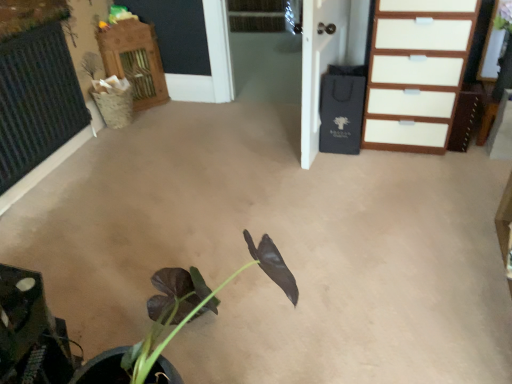
The height and width of the screenshot is (384, 512). What do you see at coordinates (134, 60) in the screenshot?
I see `wooden cabinet at upper left` at bounding box center [134, 60].

Describe the element at coordinates (416, 72) in the screenshot. I see `white glossy chest of drawers at upper right` at that location.

What do you see at coordinates (319, 64) in the screenshot? This screenshot has width=512, height=384. I see `black paper bag at upper right` at bounding box center [319, 64].

The width and height of the screenshot is (512, 384). What are the coordinates of `wooden cabinet at upper left` in the screenshot? It's located at (134, 60).

Is wooden cabinet at upper left inside black paper bag at upper right?

No, black paper bag at upper right does not contain wooden cabinet at upper left.

Based on the photo, between black paper bag at upper right and wooden cabinet at upper left, which one is positioned behind?

wooden cabinet at upper left is more distant.

Are black paper bag at upper right and wooden cabinet at upper left making contact?

No, black paper bag at upper right is not next to wooden cabinet at upper left.

Considering the sizes of objects white glossy chest of drawers at upper right and wooden cabinet at upper left in the image provided, who is bigger, white glossy chest of drawers at upper right or wooden cabinet at upper left?

white glossy chest of drawers at upper right.

You are a GUI agent. You are given a task and a screenshot of the screen. Output one action in this format:
    pyautogui.click(x=<x>, y=<y>)
    Task: Click on the chest of drawers above the wooden cabinet at upper left (from a real-world perspective)
    
    Given the screenshot: What is the action you would take?
    pyautogui.click(x=416, y=72)

Is white glossy chest of drawers at upper right positioned far away from wooden cabinet at upper left?

Absolutely, white glossy chest of drawers at upper right is distant from wooden cabinet at upper left.

Locate an element on the screen. The height and width of the screenshot is (384, 512). the chest of drawers that is above the wooden cabinet at upper left (from a real-world perspective) is located at coordinates (416, 72).

Considering the positions of points (161, 91) and (418, 128), is point (161, 91) closer to camera compared to point (418, 128)?

No, it is not.

How much distance is there between wooden cabinet at upper left and white glossy chest of drawers at upper right?

wooden cabinet at upper left is 1.91 meters away from white glossy chest of drawers at upper right.

Can you confirm if wooden cabinet at upper left is shorter than white glossy chest of drawers at upper right?

Indeed, wooden cabinet at upper left has a lesser height compared to white glossy chest of drawers at upper right.

Between wooden cabinet at upper left and black paper bag at upper right, which one has smaller width?

Thinner between the two is black paper bag at upper right.

From a real-world perspective, which object rests below the other?

In real-world perspective, wooden cabinet at upper left is lower.

Is point (135, 54) closer or farther from the camera than point (307, 102)?

Point (135, 54).

Could you tell me if wooden cabinet at upper left is turned towards black paper bag at upper right?

No, wooden cabinet at upper left is not facing towards black paper bag at upper right.

Between white glossy chest of drawers at upper right and black paper bag at upper right, which one appears on the left side from the viewer's perspective?

black paper bag at upper right.

Does white glossy chest of drawers at upper right turn towards black paper bag at upper right?

No, white glossy chest of drawers at upper right is not oriented towards black paper bag at upper right.

Is the surface of white glossy chest of drawers at upper right in direct contact with black paper bag at upper right?

No, white glossy chest of drawers at upper right is not in contact with black paper bag at upper right.

Which is behind, point (437, 16) or point (304, 148)?

Point (304, 148)

Who is taller, black paper bag at upper right or white glossy chest of drawers at upper right?

With more height is black paper bag at upper right.

Which is behind, black paper bag at upper right or white glossy chest of drawers at upper right?

white glossy chest of drawers at upper right is behind.

Is black paper bag at upper right aimed at white glossy chest of drawers at upper right?

Yes, black paper bag at upper right faces towards white glossy chest of drawers at upper right.

Identify the location of door below the wooden cabinet at upper left (from the image's perspective). 319,64.

Find the location of `dresser that appears below the white glossy chest of drawers at upper right (from a real-world perspective)`. dresser that appears below the white glossy chest of drawers at upper right (from a real-world perspective) is located at coordinates (x=134, y=60).

When comparing their distances from black paper bag at upper right, does white glossy chest of drawers at upper right or wooden cabinet at upper left seem closer?

white glossy chest of drawers at upper right.

When comparing their distances from black paper bag at upper right, does wooden cabinet at upper left or white glossy chest of drawers at upper right seem further?

Among the two, wooden cabinet at upper left is located further to black paper bag at upper right.

Considering their positions, is black paper bag at upper right positioned further to white glossy chest of drawers at upper right than wooden cabinet at upper left?

wooden cabinet at upper left.

From the image, which object appears to be farther from wooden cabinet at upper left, black paper bag at upper right or white glossy chest of drawers at upper right?

Based on the image, white glossy chest of drawers at upper right appears to be further to wooden cabinet at upper left.

Which object lies further to the anchor point wooden cabinet at upper left, white glossy chest of drawers at upper right or black paper bag at upper right?

Among the two, white glossy chest of drawers at upper right is located further to wooden cabinet at upper left.

Consider the image. Considering their positions, is wooden cabinet at upper left positioned closer to white glossy chest of drawers at upper right than black paper bag at upper right?

black paper bag at upper right is positioned closer to the anchor white glossy chest of drawers at upper right.

The height and width of the screenshot is (384, 512). Identify the location of door between wooden cabinet at upper left and white glossy chest of drawers at upper right. (319, 64).